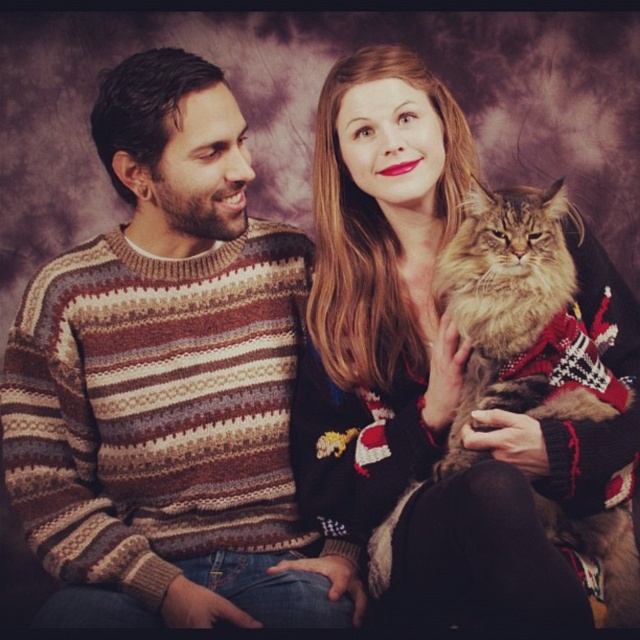
Question: Can you confirm if smooth black sweater at upper right is positioned to the left of fuzzy brown cat at right?

Choices:
 (A) yes
 (B) no

Answer: (A)

Question: Estimate the real-world distances between objects in this image. Which object is closer to the knitted sweater at left?

Choices:
 (A) fuzzy brown cat at right
 (B) smooth black sweater at upper right

Answer: (B)

Question: Is knitted sweater at left bigger than smooth black sweater at upper right?

Choices:
 (A) no
 (B) yes

Answer: (A)

Question: Based on their relative distances, which object is farther from the knitted sweater at left?

Choices:
 (A) fuzzy brown cat at right
 (B) smooth black sweater at upper right

Answer: (A)

Question: Considering the relative positions of knitted sweater at left and smooth black sweater at upper right in the image provided, where is knitted sweater at left located with respect to smooth black sweater at upper right?

Choices:
 (A) right
 (B) left

Answer: (B)

Question: Estimate the real-world distances between objects in this image. Which object is farther from the knitted sweater at left?

Choices:
 (A) smooth black sweater at upper right
 (B) fuzzy brown cat at right

Answer: (B)